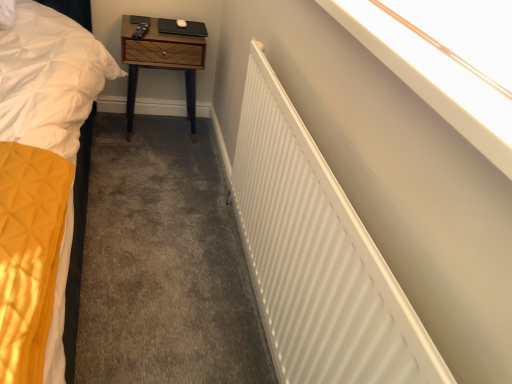
Find the location of `white matte radiator at upper right`. white matte radiator at upper right is located at coordinates (316, 256).

What do you see at coordinates (434, 78) in the screenshot? I see `white smooth wall at upper right` at bounding box center [434, 78].

Locate an element on the screen. This screenshot has height=384, width=512. white matte radiator at upper right is located at coordinates (316, 256).

This screenshot has height=384, width=512. Find the location of `nightstand that is on the left side of white smooth wall at upper right`. nightstand that is on the left side of white smooth wall at upper right is located at coordinates (161, 62).

Is white smooth wall at upper right far away from woodenmaterial/texturenightstand at upper center?

Absolutely, white smooth wall at upper right is distant from woodenmaterial/texturenightstand at upper center.

Does point (347, 5) appear closer or farther from the camera than point (172, 67)?

Point (347, 5) appears to be closer to the viewer than point (172, 67).

In the scene shown: Does white matte radiator at upper right have a lesser height compared to woodenmaterial/texturenightstand at upper center?

In fact, white matte radiator at upper right may be taller than woodenmaterial/texturenightstand at upper center.

Consider the image. Which of these two, white matte radiator at upper right or woodenmaterial/texturenightstand at upper center, is bigger?

white matte radiator at upper right.

Does white matte radiator at upper right have a greater width compared to woodenmaterial/texturenightstand at upper center?

In fact, white matte radiator at upper right might be narrower than woodenmaterial/texturenightstand at upper center.

Looking at this image, considering the relative positions of white matte radiator at upper right and woodenmaterial/texturenightstand at upper center in the image provided, is white matte radiator at upper right to the left or to the right of woodenmaterial/texturenightstand at upper center?

From the image, it's evident that white matte radiator at upper right is to the right of woodenmaterial/texturenightstand at upper center.

Considering the relative sizes of white smooth wall at upper right and white matte radiator at upper right in the image provided, is white smooth wall at upper right taller than white matte radiator at upper right?

No.

What's the angular difference between white smooth wall at upper right and white matte radiator at upper right's facing directions?

There is a 0.078-degree angle between the facing directions of white smooth wall at upper right and white matte radiator at upper right.

Considering the points (419, 88) and (357, 346), which point is in front, point (419, 88) or point (357, 346)?

Point (419, 88)

Considering the relative sizes of woodenmaterial/texturenightstand at upper center and white smooth wall at upper right in the image provided, is woodenmaterial/texturenightstand at upper center smaller than white smooth wall at upper right?

Incorrect, woodenmaterial/texturenightstand at upper center is not smaller in size than white smooth wall at upper right.

Which of these two, woodenmaterial/texturenightstand at upper center or white smooth wall at upper right, stands shorter?

white smooth wall at upper right.

You are a GUI agent. You are given a task and a screenshot of the screen. Output one action in this format:
    pyautogui.click(x=<x>, y=<y>)
    Task: Click on the nightstand below the white smooth wall at upper right (from a real-world perspective)
    Image resolution: width=512 pixels, height=384 pixels.
    Given the screenshot: What is the action you would take?
    point(161,62)

Is woodenmaterial/texturenightstand at upper center in front of or behind white smooth wall at upper right in the image?

woodenmaterial/texturenightstand at upper center is behind white smooth wall at upper right.

Does white matte radiator at upper right touch white smooth wall at upper right?

No, white matte radiator at upper right is not in contact with white smooth wall at upper right.

Considering the positions of point (421, 378) and point (417, 49), is point (421, 378) closer or farther from the camera than point (417, 49)?

Point (421, 378) is positioned closer to the camera compared to point (417, 49).

Considering the relative sizes of white matte radiator at upper right and white smooth wall at upper right in the image provided, is white matte radiator at upper right shorter than white smooth wall at upper right?

No, white matte radiator at upper right is not shorter than white smooth wall at upper right.

How different are the orientations of white matte radiator at upper right and white smooth wall at upper right in degrees?

The facing directions of white matte radiator at upper right and white smooth wall at upper right are 0.078 degrees apart.

Who is shorter, woodenmaterial/texturenightstand at upper center or white matte radiator at upper right?

woodenmaterial/texturenightstand at upper center.

This screenshot has width=512, height=384. I want to click on radiator that is above the woodenmaterial/texturenightstand at upper center (from a real-world perspective), so click(x=316, y=256).

Between woodenmaterial/texturenightstand at upper center and white matte radiator at upper right, which one appears on the right side from the viewer's perspective?

white matte radiator at upper right.

Does point (193, 56) come farther from viewer compared to point (347, 269)?

Yes, it is.

This screenshot has width=512, height=384. Identify the location of nightstand behind the white smooth wall at upper right. (161, 62).

This screenshot has width=512, height=384. I want to click on nightstand lying above the white matte radiator at upper right (from the image's perspective), so click(x=161, y=62).

Which object lies further to the anchor point white matte radiator at upper right, woodenmaterial/texturenightstand at upper center or white smooth wall at upper right?

Based on the image, woodenmaterial/texturenightstand at upper center appears to be further to white matte radiator at upper right.

Considering their positions, is woodenmaterial/texturenightstand at upper center positioned further to white smooth wall at upper right than white matte radiator at upper right?

woodenmaterial/texturenightstand at upper center lies further to white smooth wall at upper right than the other object.

Looking at the image, which one is located further to woodenmaterial/texturenightstand at upper center, white smooth wall at upper right or white matte radiator at upper right?

white smooth wall at upper right.

Which object lies further to the anchor point white matte radiator at upper right, white smooth wall at upper right or woodenmaterial/texturenightstand at upper center?

Among the two, woodenmaterial/texturenightstand at upper center is located further to white matte radiator at upper right.

Which object lies nearer to the anchor point woodenmaterial/texturenightstand at upper center, white matte radiator at upper right or white smooth wall at upper right?

Based on the image, white matte radiator at upper right appears to be nearer to woodenmaterial/texturenightstand at upper center.

From the image, which object appears to be nearer to white smooth wall at upper right, white matte radiator at upper right or woodenmaterial/texturenightstand at upper center?

Among the two, white matte radiator at upper right is located nearer to white smooth wall at upper right.

You are a GUI agent. You are given a task and a screenshot of the screen. Output one action in this format:
    pyautogui.click(x=<x>, y=<y>)
    Task: Click on the radiator between white smooth wall at upper right and woodenmaterial/texturenightstand at upper center from front to back
    
    Given the screenshot: What is the action you would take?
    pyautogui.click(x=316, y=256)